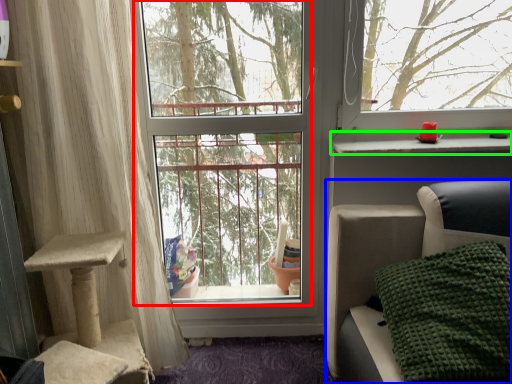
Question: Considering the real-world distances, which object is farthest from window screen (highlighted by a red box)? furniture (highlighted by a blue box) or window sill (highlighted by a green box)?

Choices:
 (A) furniture
 (B) window sill

Answer: (B)